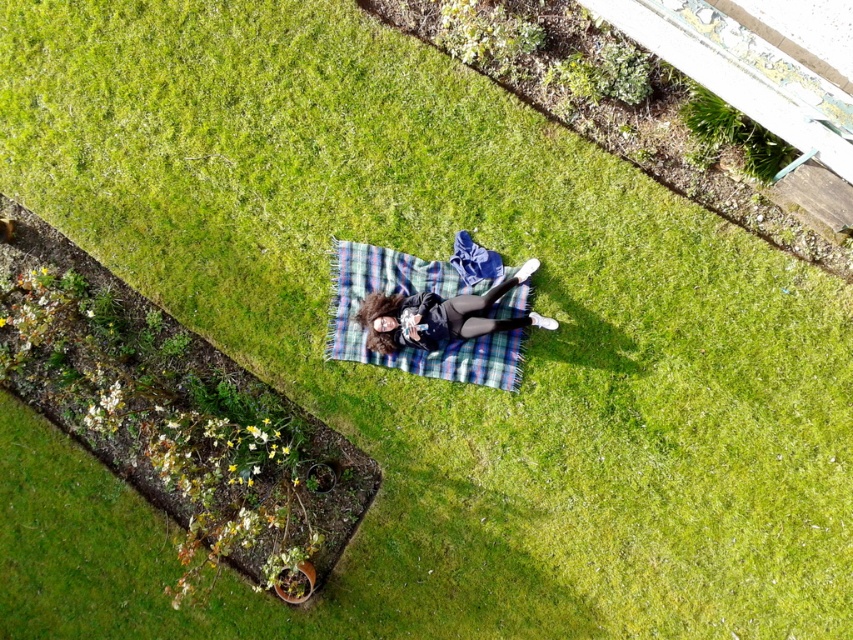
Can you confirm if plaid fabric blanket at center is positioned below matte black jacket at center?

Yes, plaid fabric blanket at center is below matte black jacket at center.

Who is taller, plaid fabric blanket at center or matte black jacket at center?

plaid fabric blanket at center

Is point (440, 372) farther from camera compared to point (514, 321)?

That is True.

Find the location of a particular element. The image size is (853, 640). plaid fabric blanket at center is located at coordinates (407, 292).